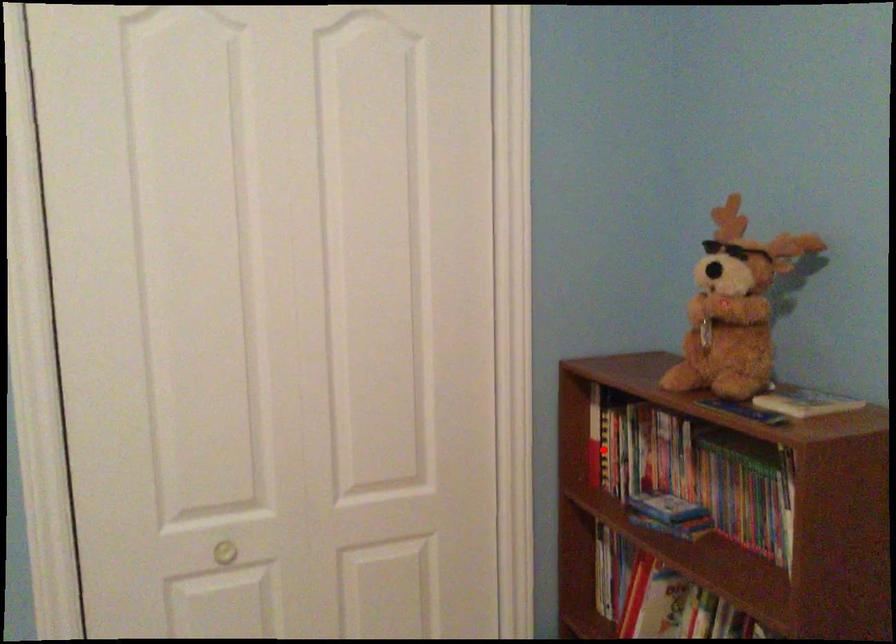
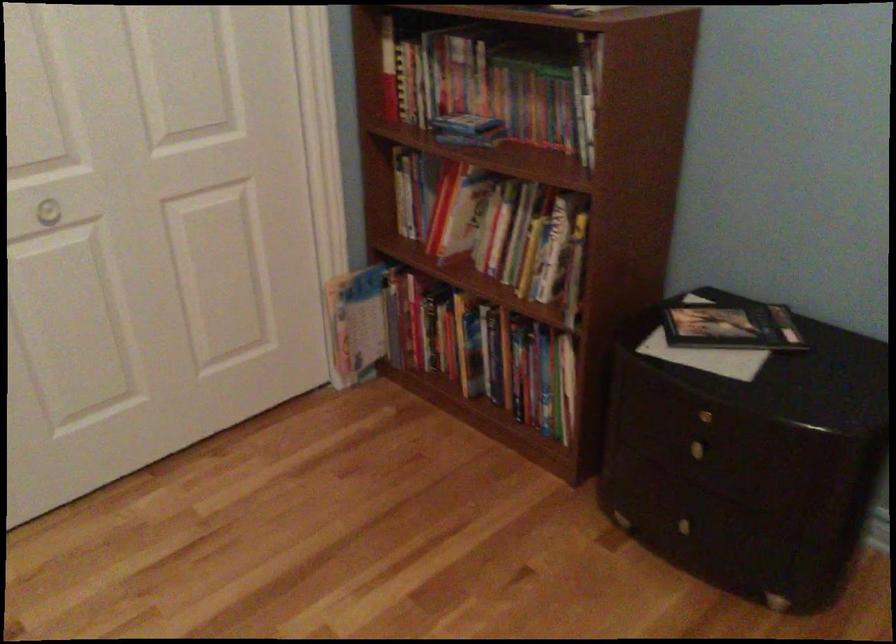
Locate, in the second image, the point that corresponds to the highlighted location in the first image.

(399, 84)